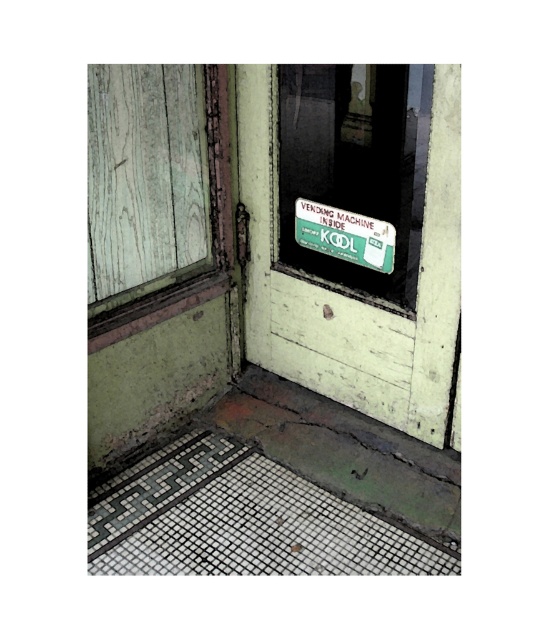
Question: Which object is closer to the camera taking this photo?

Choices:
 (A) green matte vending machine at upper center
 (B) green matte screen door at center

Answer: (B)

Question: Is weathered wood window at upper left below green matte sign at center?

Choices:
 (A) yes
 (B) no

Answer: (A)

Question: Can you confirm if green matte screen door at center is positioned below weathered wood window at upper left?

Choices:
 (A) no
 (B) yes

Answer: (B)

Question: From the image, what is the correct spatial relationship of weathered wood window at upper left in relation to green matte sign at center?

Choices:
 (A) right
 (B) left

Answer: (B)

Question: Which point is farther to the camera?

Choices:
 (A) green matte screen door at center
 (B) weathered wood window at upper left

Answer: (B)

Question: Which object is the closest to the green matte screen door at center?

Choices:
 (A) green matte vending machine at upper center
 (B) green matte sign at center
 (C) weathered wood window at upper left

Answer: (B)